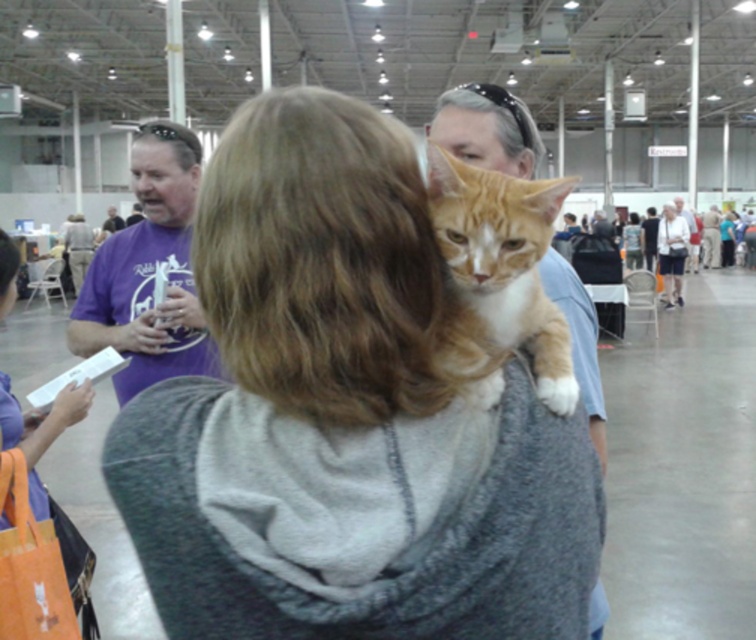
Which of these two, purple t-shirt at left or smooth blue shirt at upper right, stands shorter?

smooth blue shirt at upper right is shorter.

Who is lower down, purple t-shirt at left or smooth blue shirt at upper right?

Positioned lower is smooth blue shirt at upper right.

Between point (135, 148) and point (466, 145), which one is positioned in front?

Point (466, 145) is more forward.

This screenshot has width=756, height=640. Identify the location of purple t-shirt at left. (147, 272).

Is purple fabric bag at lower left bigger than smooth blue shirt at upper right?

Indeed, purple fabric bag at lower left has a larger size compared to smooth blue shirt at upper right.

Does point (64, 595) come in front of point (513, 118)?

No, (64, 595) is further to viewer.

Locate an element on the screen. purple fabric bag at lower left is located at coordinates (36, 524).

Can you confirm if orange fur cat at upper center is taller than purple t-shirt at left?

In fact, orange fur cat at upper center may be shorter than purple t-shirt at left.

Which is more to the left, orange fur cat at upper center or purple t-shirt at left?

Positioned to the left is purple t-shirt at left.

Is point (538, 204) behind point (181, 369)?

No, it is not.

Locate an element on the screen. The width and height of the screenshot is (756, 640). orange fur cat at upper center is located at coordinates (499, 276).